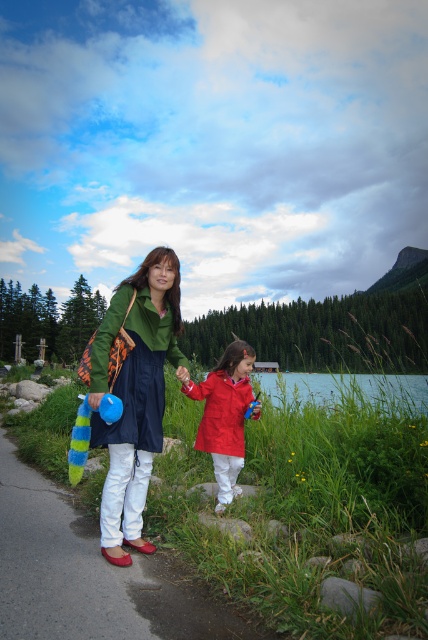
You are a photographer setting up a tripod in the scene. You need to place it between the matte red jacket at center and the green grass at lower center. Considering their widths, which object should you position the tripod closer to?

The matte red jacket at center has a smaller width than the green grass at lower center, so the tripod should be placed closer to the matte red jacket at center to ensure proper balance between the two objects.

You are a photographer trying to capture the matte red jacket at center and the green grass at lower center in a single shot. Which object will appear closer to the camera in the photo?

The matte red jacket at center will appear closer to the camera in the photo because it is positioned in front of the green grass at lower center.

You are planning to walk along the white smooth path at lower left while avoiding stepping on the matte green dress at center. Can you walk on the path without stepping on the dress?

The white smooth path at lower left is wider than the matte green dress at center, so yes, you can walk on the path without stepping on the dress.